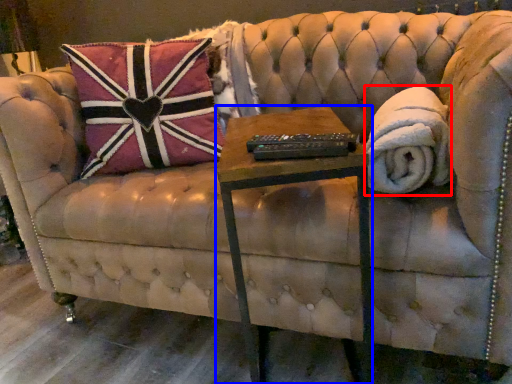
Question: Which of the following is the closest to the observer, blanket (highlighted by a red box) or table (highlighted by a blue box)?

Choices:
 (A) blanket
 (B) table

Answer: (B)